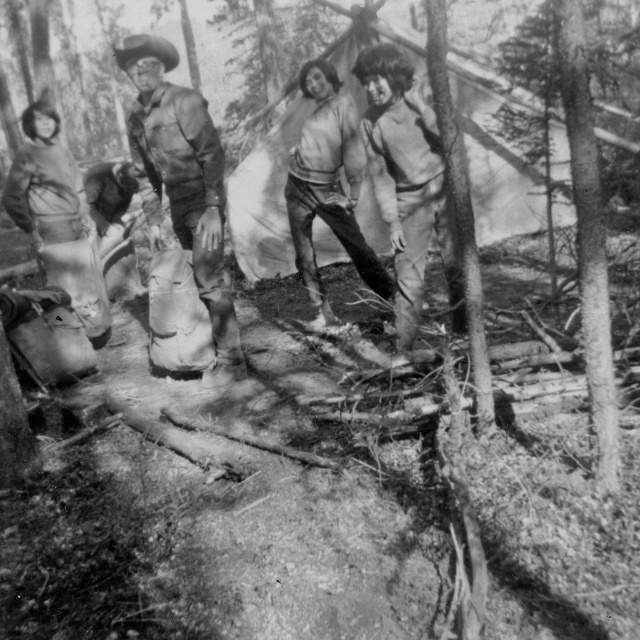
Which of these two, matte khaki pants at center or light gray sweater at center, stands taller?

light gray sweater at center is taller.

Which is above, matte khaki pants at center or light gray sweater at center?

light gray sweater at center is higher up.

Between point (381, 124) and point (356, 156), which one is positioned in front?

Positioned in front is point (381, 124).

I want to click on matte khaki pants at center, so click(x=404, y=179).

At what (x,y) coordinates should I click in order to perform the action: click on leather boots at center. Please return your answer as a coordinate pair (x, y). The height and width of the screenshot is (640, 640). Looking at the image, I should click on (182, 182).

Does leather boots at center appear on the left side of matte khaki pants at center?

Correct, you'll find leather boots at center to the left of matte khaki pants at center.

What are the coordinates of `leather boots at center` in the screenshot? It's located at (182, 182).

What are the coordinates of `leather boots at center` in the screenshot? It's located at (182, 182).

Does leather boots at center appear under light gray sweater at center?

Yes.

Does point (160, 77) come behind point (353, 195)?

No.

In order to click on leather boots at center in this screenshot , I will do `click(182, 182)`.